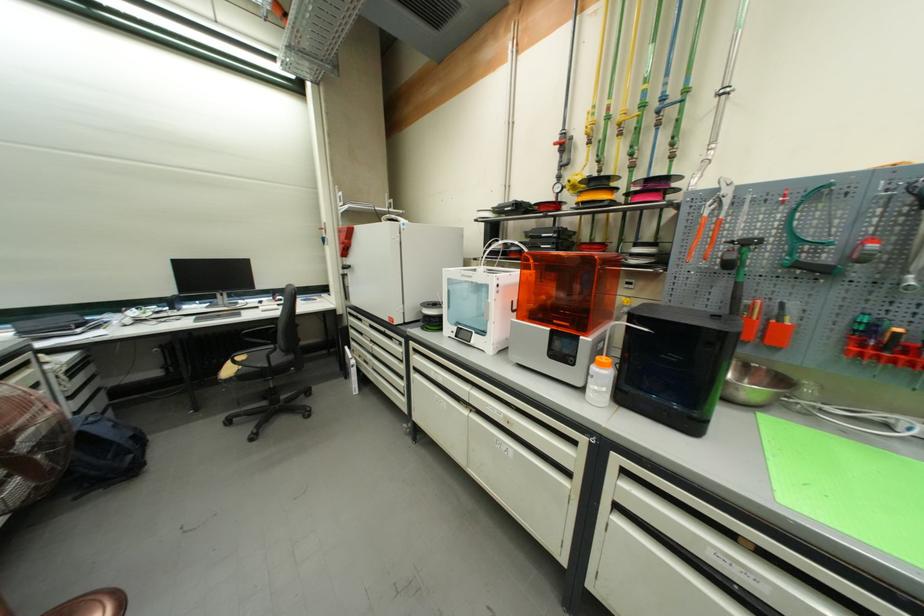
Locate an element on the screen. The width and height of the screenshot is (924, 616). black filament spool is located at coordinates point(675,363).